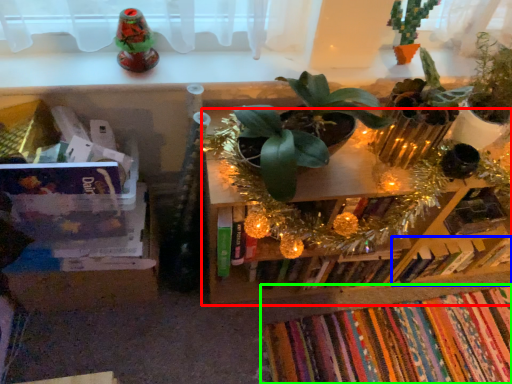
Question: Which object is positioned farthest from shelf (highlighted by a red box)? Select from book (highlighted by a blue box) and book (highlighted by a green box).

Choices:
 (A) book
 (B) book

Answer: (B)